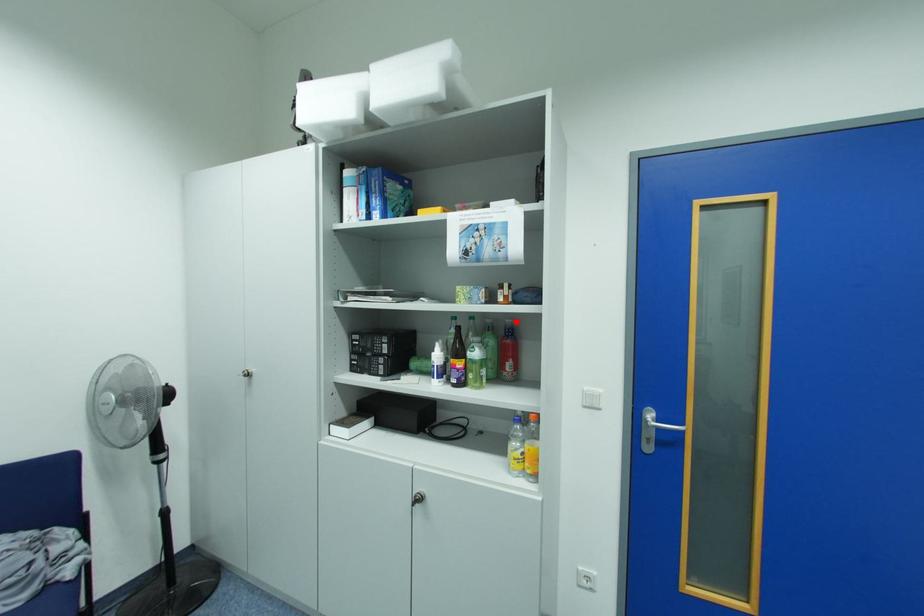
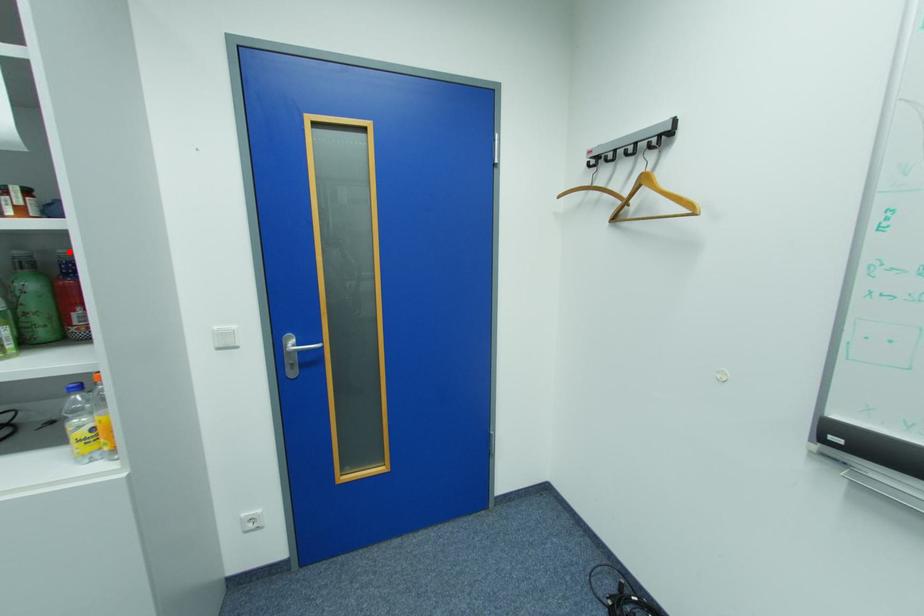
I am providing you with two images of the same scene from different viewpoints. A red point is marked on the first image and another point is marked on the second image. Is the marked point in image1 the same physical position as the marked point in image2?

Yes